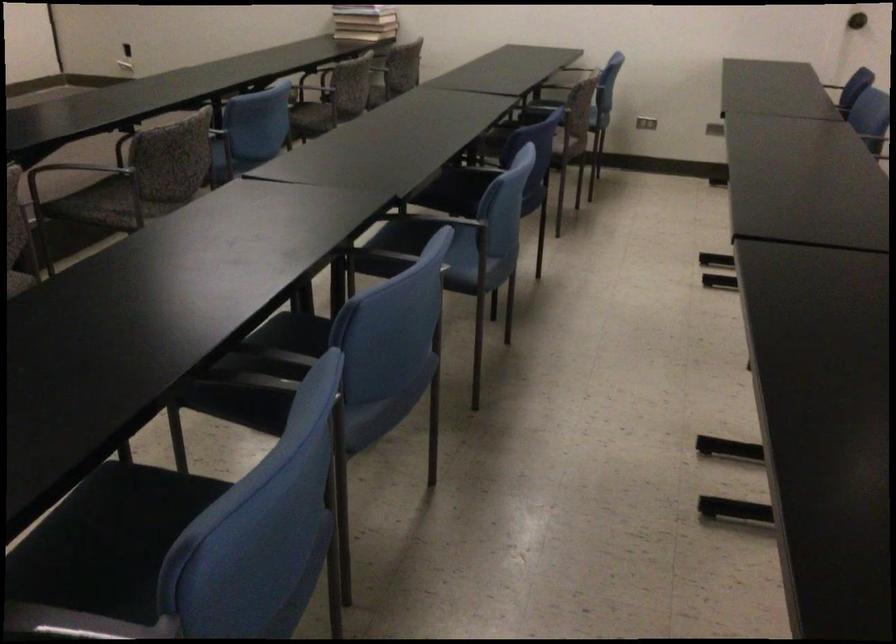
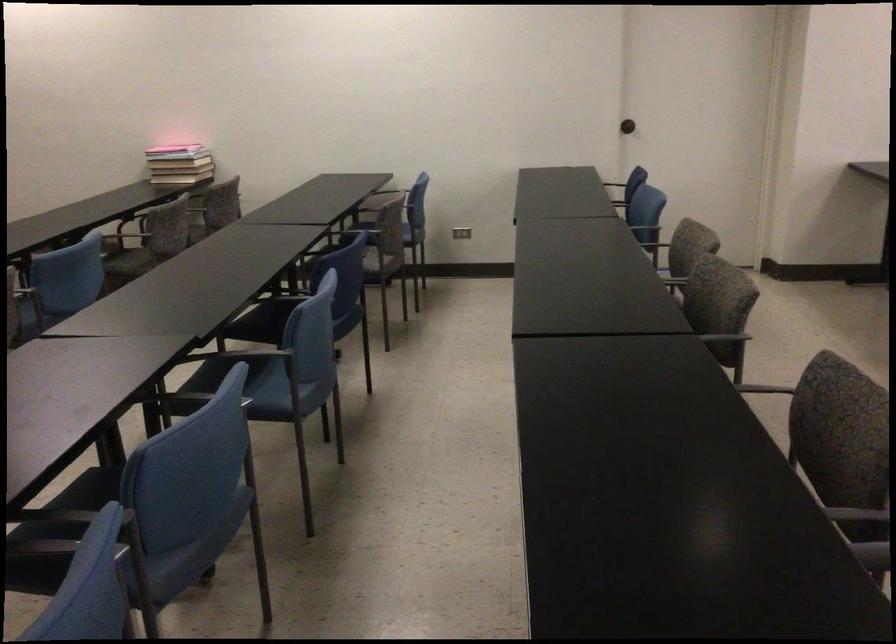
The images are taken continuously from a first-person perspective. In which direction are you moving?

The cameraman moved toward right, backward.